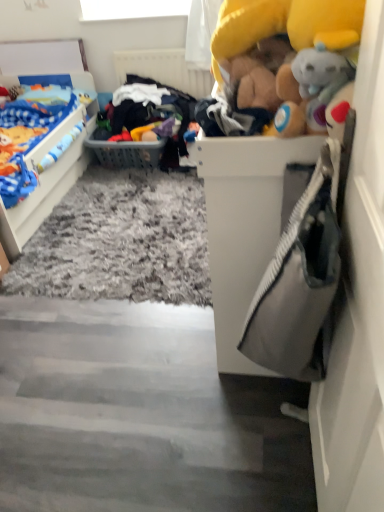
Image resolution: width=384 pixels, height=512 pixels. I want to click on free space above shaggy carpet at lower center (from a real-world perspective), so click(126, 321).